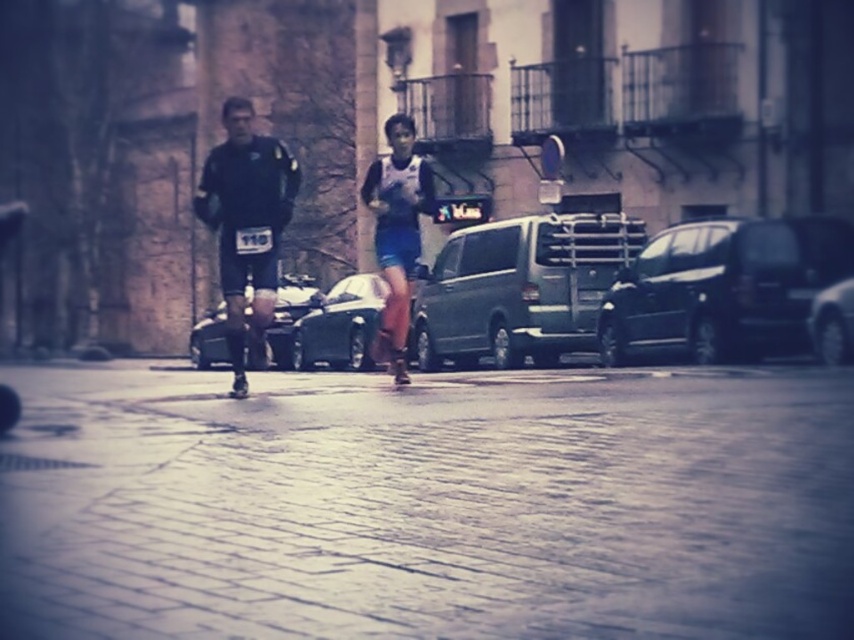
Question: Which point is farther to the camera?

Choices:
 (A) (376, 276)
 (B) (422, 625)

Answer: (A)

Question: Is shiny black car at center to the left of black matte roller skate at center from the viewer's perspective?

Choices:
 (A) yes
 (B) no

Answer: (B)

Question: Which object appears closest to the camera in this image?

Choices:
 (A) shiny black car at center
 (B) metallic silver van at center
 (C) blue fabric shorts at center
 (D) black matte roller skate at center

Answer: (B)

Question: Can you confirm if brick pavement at center is positioned above metallic silver van at center?

Choices:
 (A) no
 (B) yes

Answer: (A)

Question: Which point appears closest to the camera in this image?

Choices:
 (A) (203, 186)
 (B) (395, 355)
 (C) (243, 380)

Answer: (A)

Question: In this image, where is brick pavement at center located relative to blue fabric shorts at center?

Choices:
 (A) right
 (B) left

Answer: (A)